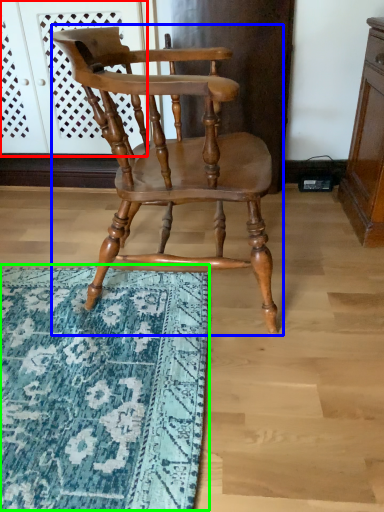
Question: Which is nearer to the screen door (highlighted by a red box)? chair (highlighted by a blue box) or mat (highlighted by a green box).

Choices:
 (A) chair
 (B) mat

Answer: (A)